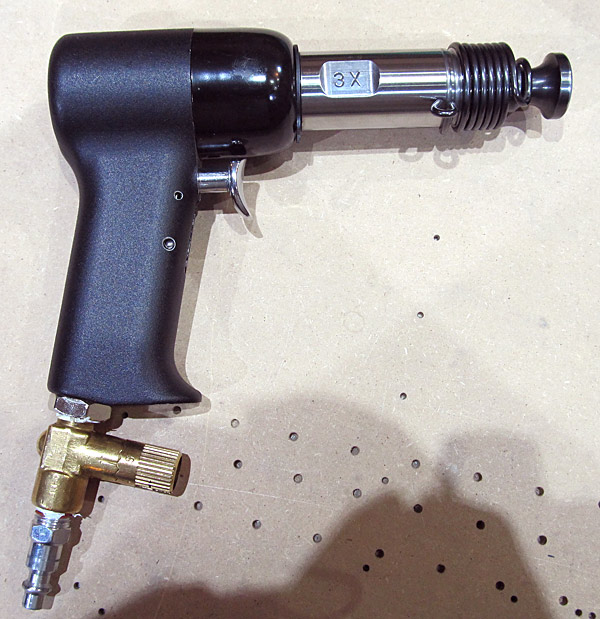
Find the location of a particular element. handle is located at coordinates (138, 243).